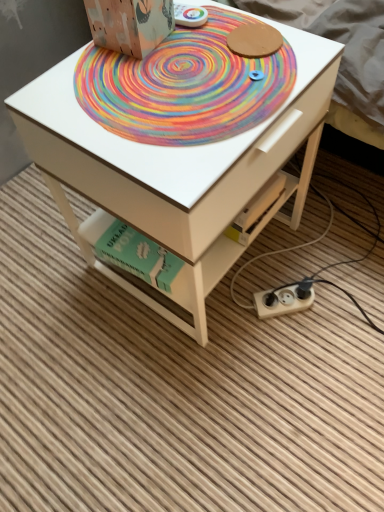
Question: Does white plastic plug at lower right appear on the right side of green cardboard book at lower center?

Choices:
 (A) no
 (B) yes

Answer: (B)

Question: From the image's perspective, is white plastic plug at lower right located beneath green cardboard book at lower center?

Choices:
 (A) yes
 (B) no

Answer: (A)

Question: Is white plastic plug at lower right placed right next to green cardboard book at lower center?

Choices:
 (A) yes
 (B) no

Answer: (B)

Question: Is white plastic plug at lower right at the left side of green cardboard book at lower center?

Choices:
 (A) yes
 (B) no

Answer: (B)

Question: From a real-world perspective, is white plastic plug at lower right located beneath green cardboard book at lower center?

Choices:
 (A) no
 (B) yes

Answer: (B)

Question: Considering the positions of green cardboard book at lower center and rainbow painted mat at center in the image, is green cardboard book at lower center bigger or smaller than rainbow painted mat at center?

Choices:
 (A) small
 (B) big

Answer: (B)

Question: Considering the positions of green cardboard book at lower center and rainbow painted mat at center in the image, is green cardboard book at lower center wider or thinner than rainbow painted mat at center?

Choices:
 (A) thin
 (B) wide

Answer: (A)

Question: From the image's perspective, is green cardboard book at lower center positioned above or below rainbow painted mat at center?

Choices:
 (A) above
 (B) below

Answer: (B)

Question: Would you say green cardboard book at lower center is to the left or to the right of rainbow painted mat at center in the picture?

Choices:
 (A) left
 (B) right

Answer: (A)

Question: From a real-world perspective, is white matte table at center above or below green cardboard book at lower center?

Choices:
 (A) above
 (B) below

Answer: (A)

Question: Is point (256, 137) closer or farther from the camera than point (132, 263)?

Choices:
 (A) farther
 (B) closer

Answer: (B)

Question: Is white matte table at center to the left or to the right of green cardboard book at lower center in the image?

Choices:
 (A) right
 (B) left

Answer: (A)

Question: Do you think white matte table at center is within green cardboard book at lower center, or outside of it?

Choices:
 (A) outside
 (B) inside

Answer: (A)

Question: Looking at their shapes, would you say white plastic plug at lower right is wider or thinner than wooden cardboard box at upper center?

Choices:
 (A) thin
 (B) wide

Answer: (A)

Question: From their relative heights in the image, would you say white plastic plug at lower right is taller or shorter than wooden cardboard box at upper center?

Choices:
 (A) tall
 (B) short

Answer: (B)